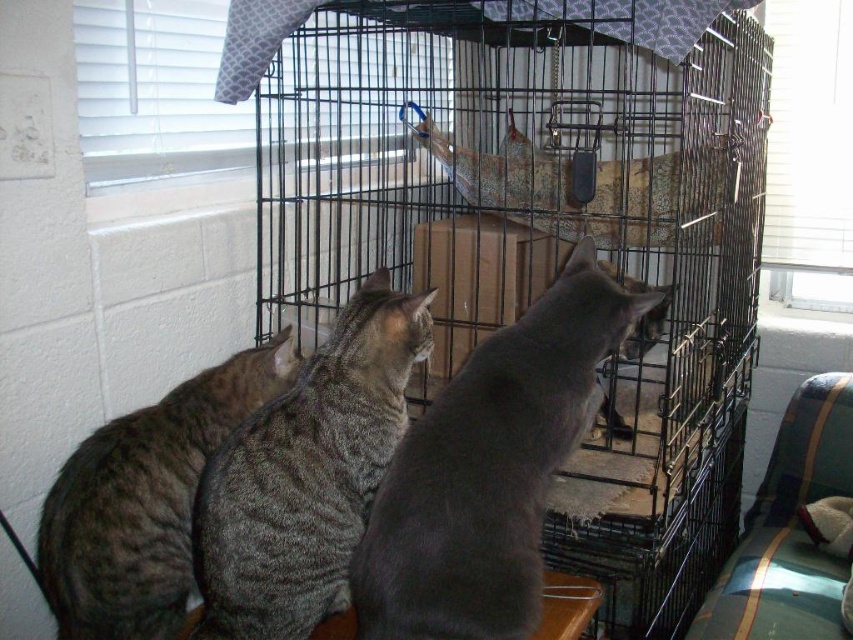
You are a cat owner trying to determine which of your two gray striped cats is closer to the cage. You see the gray striped cat at center and the gray striped cat at left. Based on their positions, which cat is closer to the cage?

The gray striped cat at center is positioned over the gray striped cat at left, so the gray striped cat at center is closer to the cage.

You are a cat owner trying to determine if your gray matte fur cat at center can reach the black wire cage at center to interact with something inside. Based on their positions, can your cat touch the cage?

The black wire cage at center is further to the viewer than gray matte fur cat at center, so the cat can touch the cage since it is closer to the cat.

You are a cat owner who wants to ensure your gray striped cat at center has enough space to move around inside the black wire cage at center. Based on the scene, can you determine if the cage is large enough?

The black wire cage at center has a larger size compared to gray striped cat at center, so it should provide sufficient space for the cat to move around comfortably.